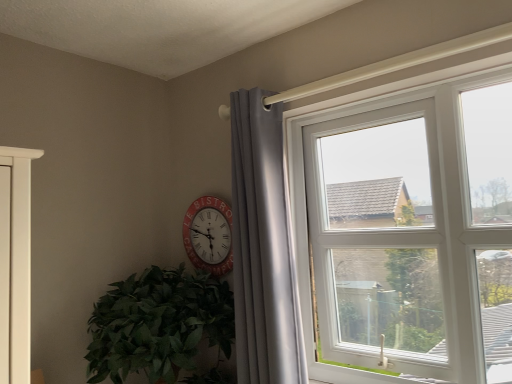
Question: Is red plastic clock at center located outside matte gray curtain at upper right?

Choices:
 (A) yes
 (B) no

Answer: (A)

Question: Does red plastic clock at center appear on the left side of matte gray curtain at upper right?

Choices:
 (A) yes
 (B) no

Answer: (A)

Question: Considering the relative sizes of red plastic clock at center and matte gray curtain at upper right in the image provided, is red plastic clock at center taller than matte gray curtain at upper right?

Choices:
 (A) yes
 (B) no

Answer: (B)

Question: Is matte gray curtain at upper right at the back of red plastic clock at center?

Choices:
 (A) no
 (B) yes

Answer: (A)

Question: Is red plastic clock at center at the right side of matte gray curtain at upper right?

Choices:
 (A) yes
 (B) no

Answer: (B)

Question: From a real-world perspective, is red plastic clock at center on top of matte gray curtain at upper right?

Choices:
 (A) no
 (B) yes

Answer: (B)

Question: Can you confirm if white plastic window at upper right is positioned to the right of matte gray curtain at upper right?

Choices:
 (A) no
 (B) yes

Answer: (B)

Question: Does white plastic window at upper right have a greater width compared to matte gray curtain at upper right?

Choices:
 (A) yes
 (B) no

Answer: (A)

Question: Does white plastic window at upper right have a larger size compared to matte gray curtain at upper right?

Choices:
 (A) yes
 (B) no

Answer: (A)

Question: Is matte gray curtain at upper right inside white plastic window at upper right?

Choices:
 (A) no
 (B) yes

Answer: (A)

Question: Is white plastic window at upper right to the left of matte gray curtain at upper right from the viewer's perspective?

Choices:
 (A) yes
 (B) no

Answer: (B)

Question: Is white plastic window at upper right not within matte gray curtain at upper right?

Choices:
 (A) no
 (B) yes

Answer: (B)

Question: From a real-world perspective, is green leafy plant at lower left under white plastic window at upper right?

Choices:
 (A) no
 (B) yes

Answer: (B)